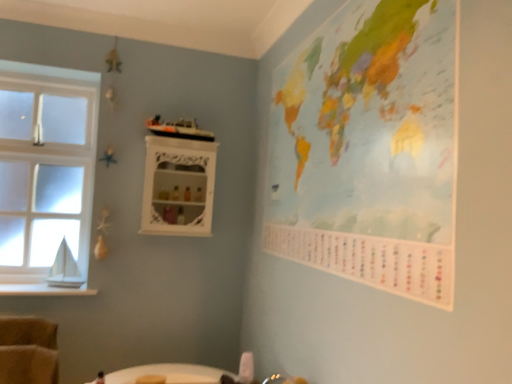
What is the approximate height of white glossy cabinet at upper center?

The height of white glossy cabinet at upper center is 54.17 centimeters.

Where is `white glossy cabinet at upper center`? white glossy cabinet at upper center is located at coordinates (178, 187).

At what (x,y) coordinates should I click in order to perform the action: click on painted paper map at upper right. Please return your answer as a coordinate pair (x, y). Looking at the image, I should click on (369, 148).

Identify the location of white glossy cabinet at upper center. This screenshot has width=512, height=384. (178, 187).

Which object is further away from the camera taking this photo, white glossy cabinet at upper center or white wood at left?

white glossy cabinet at upper center is behind.

How far apart are white glossy cabinet at upper center and white wood at left?

The distance of white glossy cabinet at upper center from white wood at left is 28.06 inches.

Who is smaller, white glossy cabinet at upper center or white wood at left?

white wood at left is smaller.

Is white glossy cabinet at upper center facing towards white wood at left?

No, white glossy cabinet at upper center is not aimed at white wood at left.

Looking at this image, from the image's perspective, which one is positioned lower, clear glass window at left or painted paper map at upper right?

clear glass window at left.

Considering the relative sizes of clear glass window at left and painted paper map at upper right in the image provided, is clear glass window at left taller than painted paper map at upper right?

Correct, clear glass window at left is much taller as painted paper map at upper right.

Is clear glass window at left inside the boundaries of painted paper map at upper right, or outside?

clear glass window at left lies outside painted paper map at upper right.

I want to click on map positioned vertically above the clear glass window at left (from a real-world perspective), so click(369, 148).

In terms of width, does clear glass window at left look wider or thinner when compared to white glossy cabinet at upper center?

Considering their sizes, clear glass window at left looks slimmer than white glossy cabinet at upper center.

Can you tell me how much clear glass window at left and white glossy cabinet at upper center differ in facing direction?

The angular difference between clear glass window at left and white glossy cabinet at upper center is 0.598 degrees.

The height and width of the screenshot is (384, 512). I want to click on shelf below the clear glass window at left (from the image's perspective), so click(178, 187).

Find the location of a particular element. The height and width of the screenshot is (384, 512). window sill in front of the clear glass window at left is located at coordinates (42, 290).

Is the surface of clear glass window at left in direct contact with white wood at left?

clear glass window at left is not next to white wood at left, and they're not touching.

Can you tell me how much clear glass window at left and white wood at left differ in facing direction?

There is a 0.598-degree angle between the facing directions of clear glass window at left and white wood at left.

From a real-world perspective, between clear glass window at left and white wood at left, who is vertically higher?

clear glass window at left.

From the picture: Does white glossy cabinet at upper center have a smaller size compared to painted paper map at upper right?

Yes, white glossy cabinet at upper center is smaller than painted paper map at upper right.

Is white glossy cabinet at upper center inside or outside of painted paper map at upper right?

white glossy cabinet at upper center is outside painted paper map at upper right.

Looking at this image, from the image's perspective, is white glossy cabinet at upper center located above or below painted paper map at upper right?

Clearly, from the image's perspective, white glossy cabinet at upper center is below painted paper map at upper right.

From a real-world perspective, is white glossy cabinet at upper center located higher than painted paper map at upper right?

No, from a real-world perspective, white glossy cabinet at upper center is not over painted paper map at upper right

Can you confirm if white wood at left is wider than painted paper map at upper right?

Correct, the width of white wood at left exceeds that of painted paper map at upper right.

Which is farther, (21, 290) or (430, 148)?

Point (21, 290)

Who is more distant, white wood at left or painted paper map at upper right?

white wood at left is behind.

Is white wood at left a part of painted paper map at upper right?

Actually, white wood at left is outside painted paper map at upper right.

Is painted paper map at upper right turned away from white wood at left?

painted paper map at upper right is not turned away from white wood at left.

Is painted paper map at upper right in front of or behind white wood at left in the image?

Visually, painted paper map at upper right is located in front of white wood at left.

This screenshot has height=384, width=512. What are the coordinates of `shelf above the white wood at left (from the image's perspective)` in the screenshot? It's located at (178, 187).

Image resolution: width=512 pixels, height=384 pixels. Find the location of `window below the painted paper map at upper right (from a real-world perspective)`. window below the painted paper map at upper right (from a real-world perspective) is located at coordinates (45, 173).

Estimate the real-world distances between objects in this image. Which object is further from painted paper map at upper right, clear glass window at left or white glossy cabinet at upper center?

Among the two, clear glass window at left is located further to painted paper map at upper right.

Looking at the image, which one is located closer to white glossy cabinet at upper center, painted paper map at upper right or clear glass window at left?

Among the two, clear glass window at left is located nearer to white glossy cabinet at upper center.

From the image, which object appears to be nearer to painted paper map at upper right, clear glass window at left or white wood at left?

clear glass window at left lies closer to painted paper map at upper right than the other object.

From the image, which object appears to be nearer to clear glass window at left, white wood at left or white glossy cabinet at upper center?

The object closer to clear glass window at left is white wood at left.

Which object lies further to the anchor point white glossy cabinet at upper center, white wood at left or clear glass window at left?

The object further to white glossy cabinet at upper center is white wood at left.

Which object lies further to the anchor point white wood at left, painted paper map at upper right or clear glass window at left?

painted paper map at upper right is further to white wood at left.

From the image, which object appears to be nearer to clear glass window at left, painted paper map at upper right or white wood at left?

white wood at left.

Looking at the image, which one is located further to clear glass window at left, painted paper map at upper right or white glossy cabinet at upper center?

painted paper map at upper right is further to clear glass window at left.

Where is `shelf situated between white wood at left and painted paper map at upper right from left to right`? The width and height of the screenshot is (512, 384). shelf situated between white wood at left and painted paper map at upper right from left to right is located at coordinates (178, 187).

I want to click on shelf between clear glass window at left and painted paper map at upper right in the horizontal direction, so click(x=178, y=187).

You are a GUI agent. You are given a task and a screenshot of the screen. Output one action in this format:
    pyautogui.click(x=<x>, y=<y>)
    Task: Click on the window sill between clear glass window at left and white glossy cabinet at upper center
    
    Given the screenshot: What is the action you would take?
    pyautogui.click(x=42, y=290)

You are a GUI agent. You are given a task and a screenshot of the screen. Output one action in this format:
    pyautogui.click(x=<x>, y=<y>)
    Task: Click on the window sill between clear glass window at left and painted paper map at upper right in the horizontal direction
    
    Given the screenshot: What is the action you would take?
    pyautogui.click(x=42, y=290)